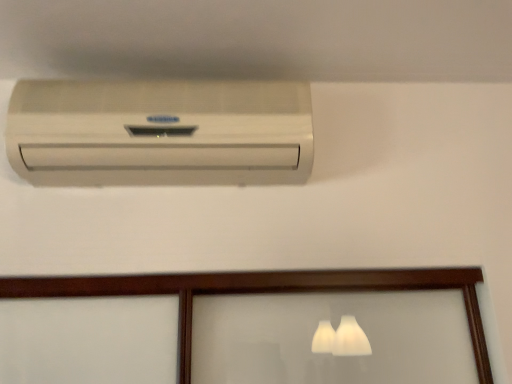
Question: In which direction should I rotate to look at white matte air conditioner at upper center?

Choices:
 (A) left
 (B) right

Answer: (A)